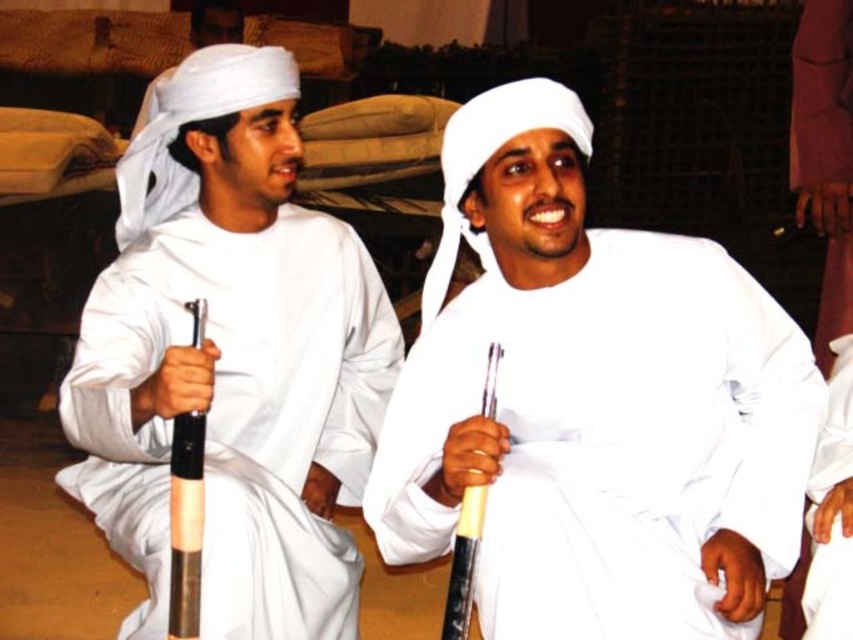
Question: Is white matte/soft cloth at center positioned at the back of white matte robe at center?

Choices:
 (A) no
 (B) yes

Answer: (A)

Question: Which object is farther from the camera taking this photo?

Choices:
 (A) white matte robe at center
 (B) white matte/soft cloth at left
 (C) white matte/soft cloth at center

Answer: (B)

Question: Which object is farther from the camera taking this photo?

Choices:
 (A) white matte/soft cloth at left
 (B) white matte/soft cloth at center

Answer: (A)

Question: Is white matte/soft cloth at center bigger than white matte robe at center?

Choices:
 (A) no
 (B) yes

Answer: (B)

Question: Which object appears closest to the camera in this image?

Choices:
 (A) white matte/soft cloth at left
 (B) white matte robe at center
 (C) white matte/soft cloth at center

Answer: (C)

Question: Is white matte/soft cloth at left to the right of white matte robe at center from the viewer's perspective?

Choices:
 (A) no
 (B) yes

Answer: (A)